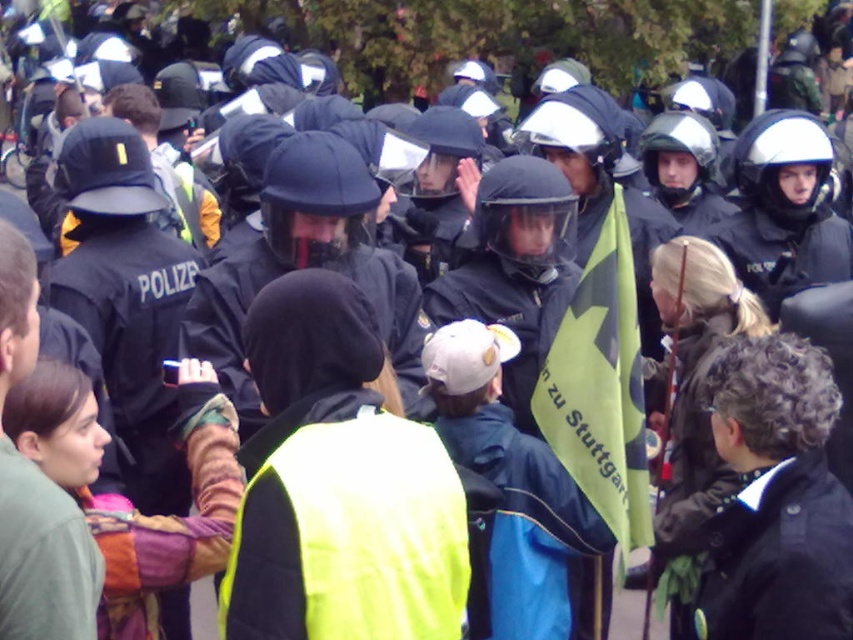
You are a photographer standing at the edge of the crowd. You want to take a photo that includes both the bright yellow reflective vest at center and the black leather jacket at lower right. Given that your camera has a maximum focus range of 3.5 feet, will you be able to capture both subjects in the same frame without moving closer?

The bright yellow reflective vest at center and the black leather jacket at lower right are 3.60 feet apart from each other. Since the distance between them exceeds the camera maximum focus range of 3.5 feet, you will not be able to capture both subjects in the same frame without moving closer.